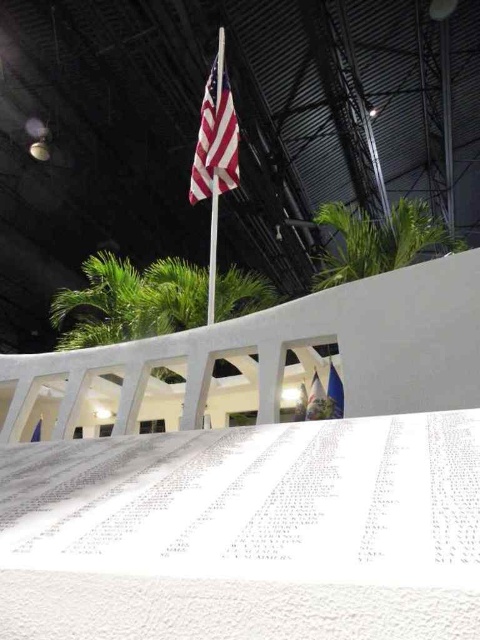
Does green leafy palm tree at upper right have a smaller size compared to american flag at upper center?

Incorrect, green leafy palm tree at upper right is not smaller in size than american flag at upper center.

Locate an element on the screen. green leafy palm tree at upper right is located at coordinates (375, 241).

Identify the location of green leafy palm tree at upper right. This screenshot has width=480, height=640. (375, 241).

Which is more to the right, metallic silver flag pole at upper center or blue fabric flag at lower center?

From the viewer's perspective, blue fabric flag at lower center appears more on the right side.

This screenshot has width=480, height=640. What do you see at coordinates (213, 244) in the screenshot?
I see `metallic silver flag pole at upper center` at bounding box center [213, 244].

Which is behind, point (210, 320) or point (326, 387)?

Positioned behind is point (210, 320).

I want to click on metallic silver flag pole at upper center, so click(213, 244).

The image size is (480, 640). Find the location of `green leafy palm tree at upper right`. green leafy palm tree at upper right is located at coordinates (375, 241).

The height and width of the screenshot is (640, 480). Describe the element at coordinates (375, 241) in the screenshot. I see `green leafy palm tree at upper right` at that location.

Which is behind, point (350, 227) or point (214, 189)?

The point (350, 227) is behind.

You are a GUI agent. You are given a task and a screenshot of the screen. Output one action in this format:
    pyautogui.click(x=<x>, y=<y>)
    Task: Click on the green leafy palm tree at upper right
    
    Given the screenshot: What is the action you would take?
    pyautogui.click(x=375, y=241)